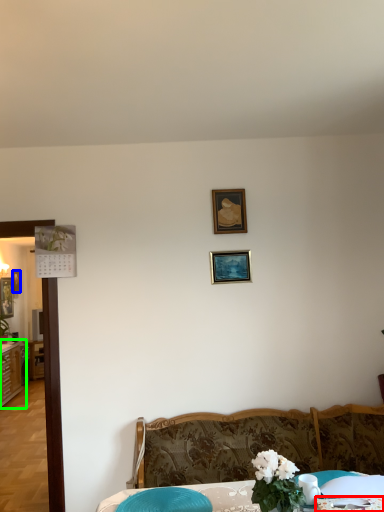
Question: Considering the real-world distances, which object is closest to tablecloth (highlighted by a red box)? picture frame (highlighted by a blue box) or dresser (highlighted by a green box).

Choices:
 (A) picture frame
 (B) dresser

Answer: (B)